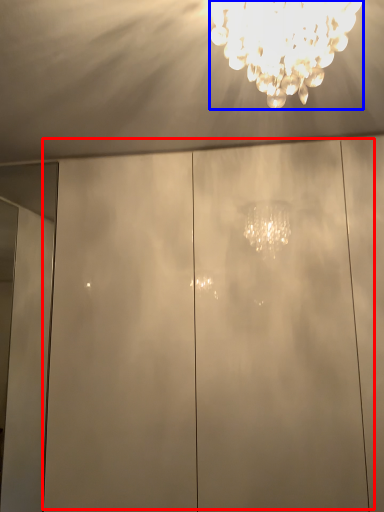
Question: Which object appears farthest to the camera in this image, glass door (highlighted by a red box) or lamp (highlighted by a blue box)?

Choices:
 (A) glass door
 (B) lamp

Answer: (A)